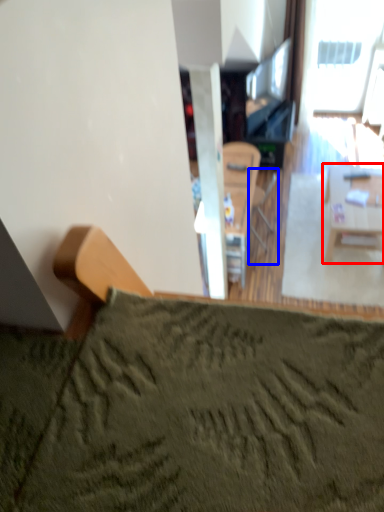
Question: Which point is further to the camera, table (highlighted by a red box) or armchair (highlighted by a blue box)?

Choices:
 (A) table
 (B) armchair

Answer: (B)